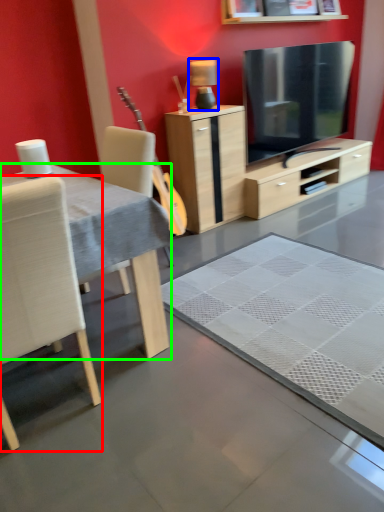
Question: Which object is positioned farthest from chair (highlighted by a red box)? Select from lamp (highlighted by a blue box) and desk (highlighted by a green box).

Choices:
 (A) lamp
 (B) desk

Answer: (A)